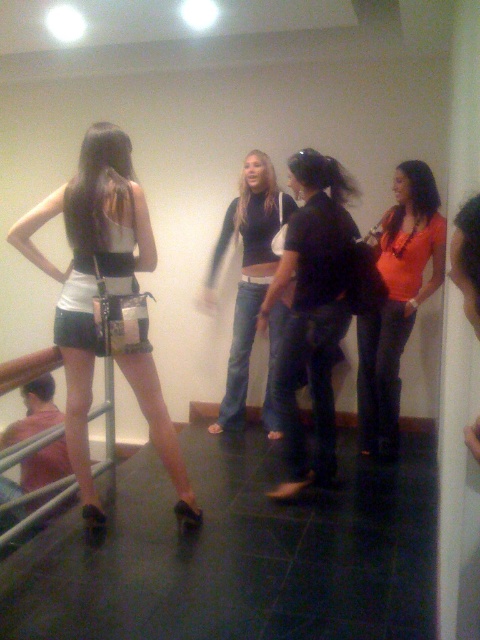
Based on the scene description, which object is taller between the denim jeans at center and the orange jersey at center?

The denim jeans at center is much taller than the orange jersey at center.

You are standing at the entrance of the hallway and see two points marked in the scene. Which point is closer to you? The two points are point (x=330, y=310) and point (x=226, y=413).

Point (x=330, y=310) is in front of point (x=226, y=413), so it is closer to you.

What is the position of the orange jersey at center in the image?

The orange jersey at center is located at point 0.470 on the x axis and 0.827 on the y axis.